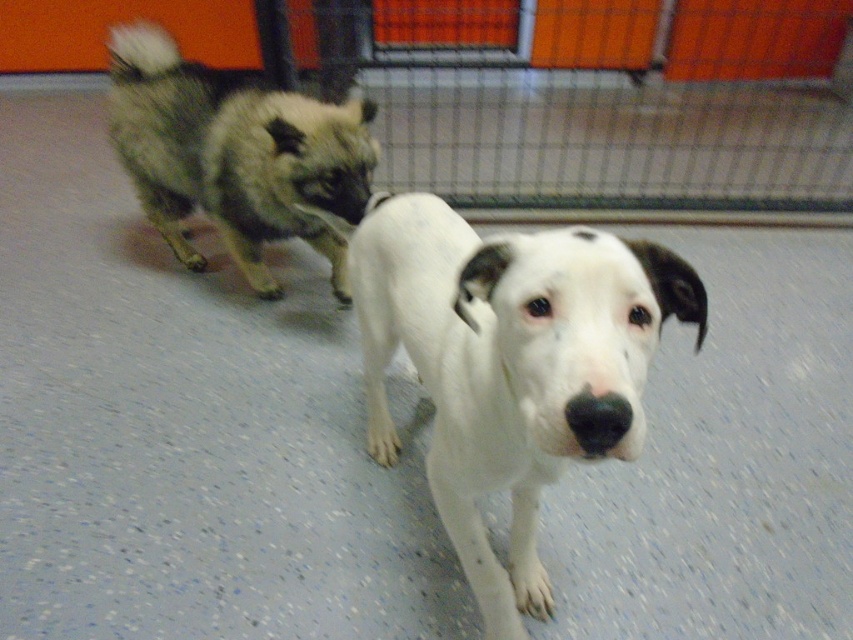
Question: Is white smooth dog at center thinner than fuzzy brown dog at upper left?

Choices:
 (A) yes
 (B) no

Answer: (A)

Question: Is white smooth dog at center closer to the viewer compared to fuzzy brown dog at upper left?

Choices:
 (A) no
 (B) yes

Answer: (B)

Question: Which of the following is the closest to the observer?

Choices:
 (A) fuzzy brown dog at upper left
 (B) white smooth dog at center

Answer: (B)

Question: In this image, where is white smooth dog at center located relative to fuzzy brown dog at upper left?

Choices:
 (A) left
 (B) right

Answer: (B)